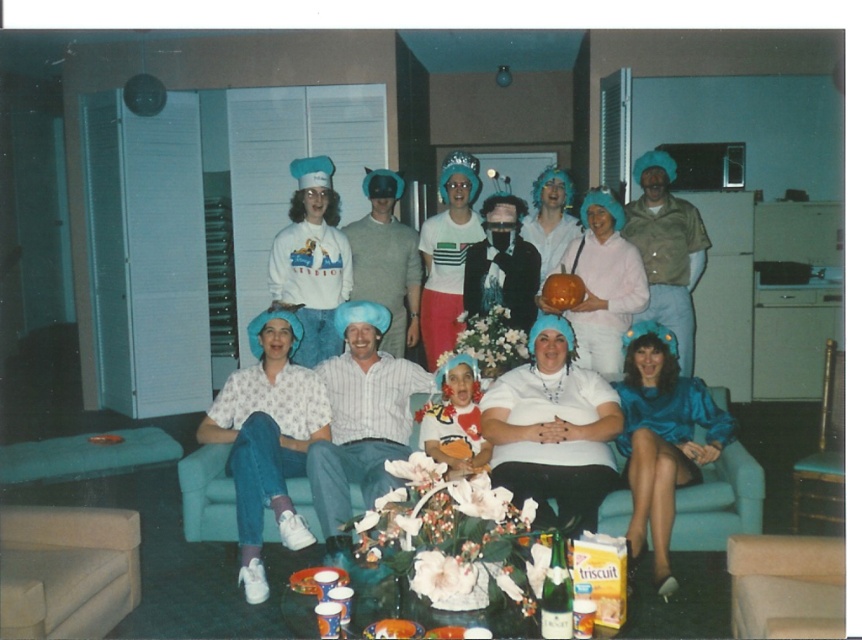
Does point (541, 234) come farther from viewer compared to point (676, 385)?

Yes, it is behind point (676, 385).

Which is more to the right, matte blue dress at center or shiny blue dress at lower right?

shiny blue dress at lower right

Find the location of a particular element. This screenshot has height=640, width=862. matte blue dress at center is located at coordinates click(x=704, y=515).

Who is more distant from viewer, [654,406] or [417,401]?

Point [417,401]

Between blue satin dress at lower right and teal fabric couch at center, which one has more height?

blue satin dress at lower right is taller.

Does point (656, 467) come closer to viewer compared to point (360, 506)?

Yes, point (656, 467) is in front of point (360, 506).

The width and height of the screenshot is (862, 640). What are the coordinates of `blue satin dress at lower right` in the screenshot? It's located at (661, 440).

Is white cotton sweatshirt at center above velvet plush teddy bear at center?

Correct, white cotton sweatshirt at center is located above velvet plush teddy bear at center.

Who is shorter, white cotton sweatshirt at center or velvet plush teddy bear at center?

With less height is velvet plush teddy bear at center.

Where is `white cotton sweatshirt at center`? This screenshot has width=862, height=640. white cotton sweatshirt at center is located at coordinates (311, 284).

Where is `white cotton sweatshirt at center`? white cotton sweatshirt at center is located at coordinates (311, 284).